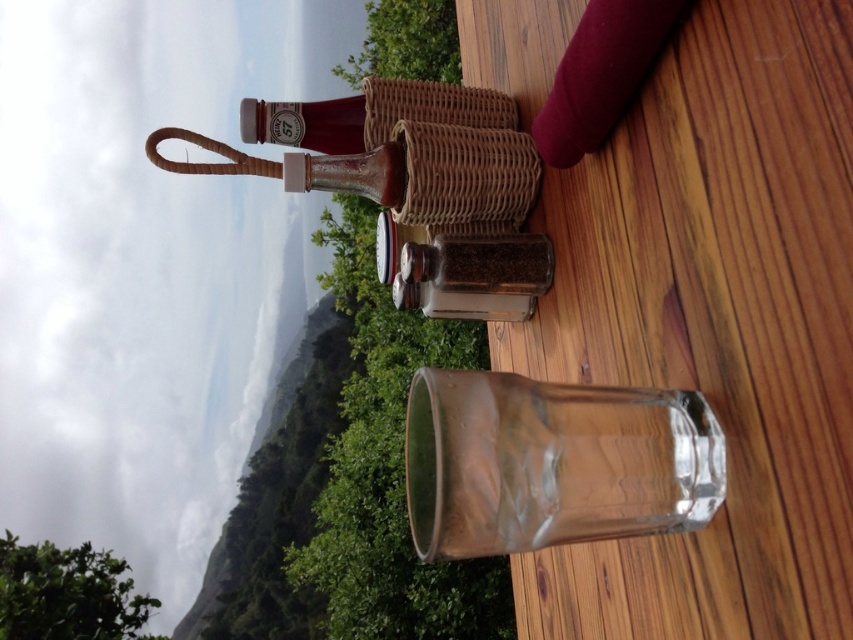
Who is taller, transparent glass at center or translucent glass bottle at upper center?

transparent glass at center is taller.

Which is more to the right, transparent glass at center or translucent glass bottle at upper center?

From the viewer's perspective, transparent glass at center appears more on the right side.

Does point (456, 531) come behind point (318, 120)?

No, it is not.

Locate an element on the screen. This screenshot has height=640, width=853. transparent glass at center is located at coordinates (552, 461).

Is clear glass shaker at center below translucent glass bottle at upper center?

Indeed, clear glass shaker at center is positioned under translucent glass bottle at upper center.

Does point (544, 276) come closer to viewer compared to point (358, 138)?

Yes, point (544, 276) is in front of point (358, 138).

Identify the location of clear glass shaker at center. The width and height of the screenshot is (853, 640). (474, 275).

Is point (453, 269) farther from camera compared to point (292, 157)?

No.

Is point (527, 250) less distant than point (393, 152)?

Yes.

Who is more distant from viewer, (454, 252) or (357, 156)?

Positioned behind is point (357, 156).

Locate an element on the screen. Image resolution: width=853 pixels, height=640 pixels. clear glass shaker at center is located at coordinates (474, 275).